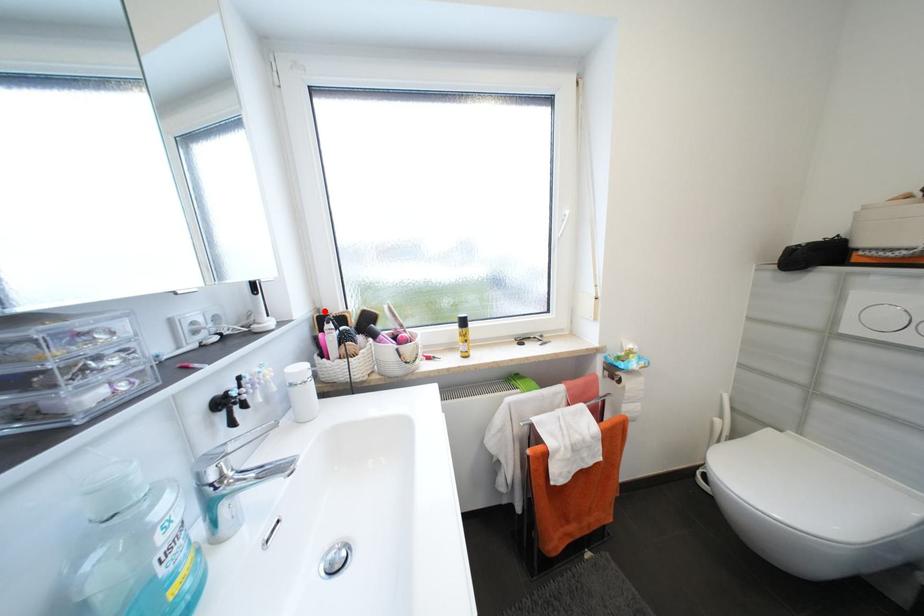
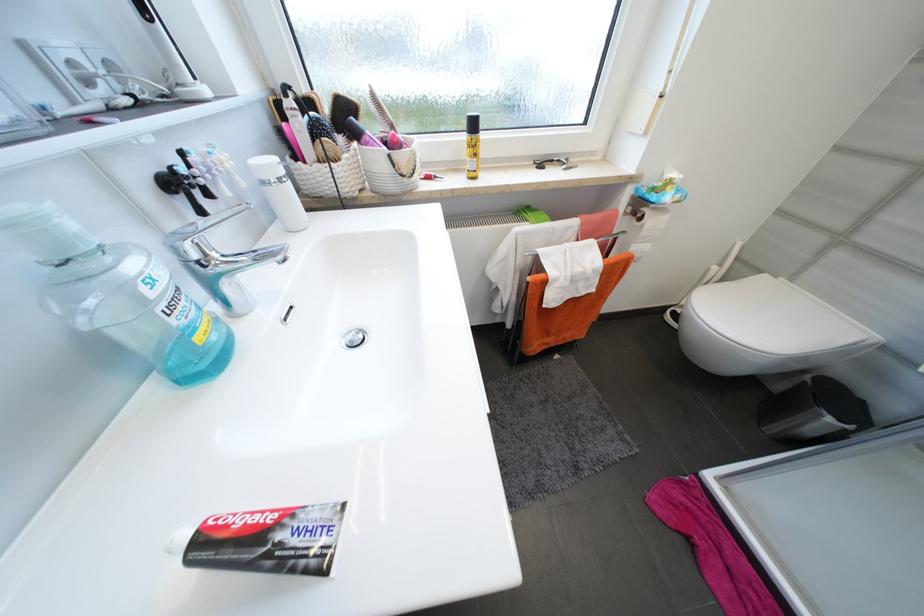
Locate, in the second image, the point that corresponds to the highlighted location in the first image.

(280, 92)